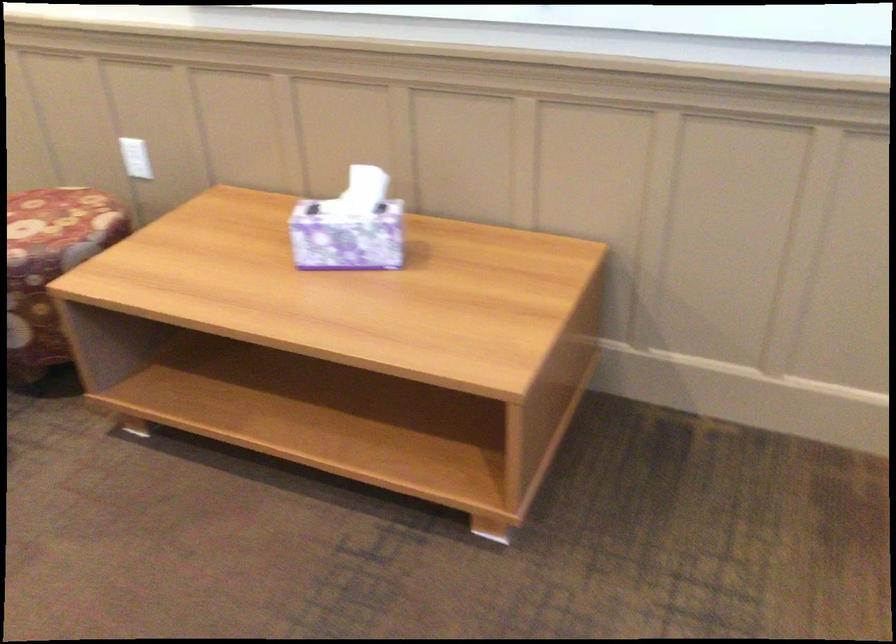
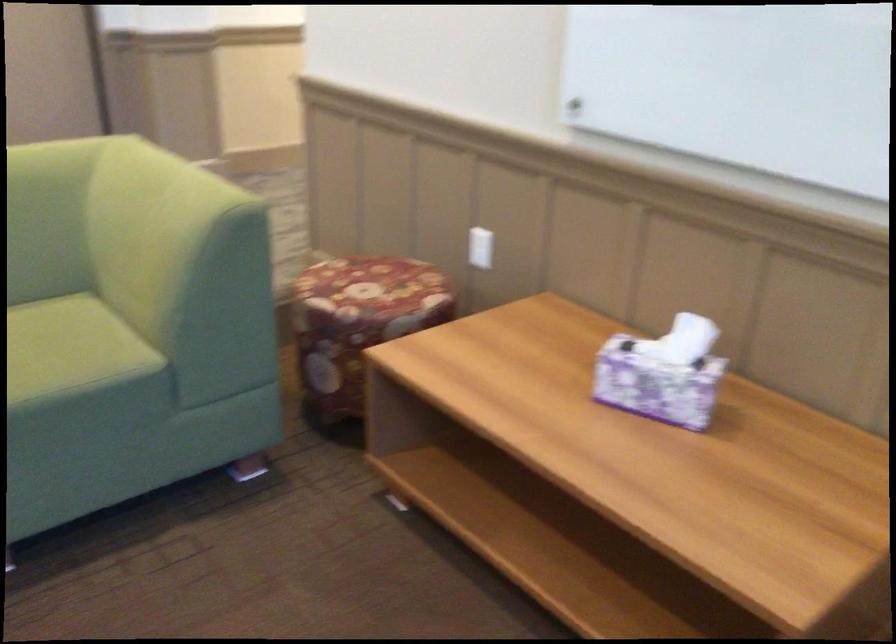
Question: The images are taken continuously from a first-person perspective. In which direction are you moving?

Choices:
 (A) Left
 (B) Right
 (C) Forward
 (D) Backward

Answer: (C)